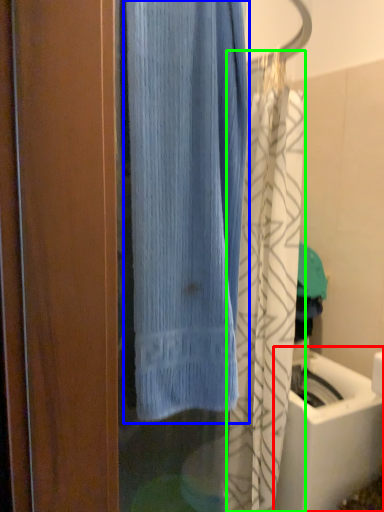
Question: Which is farther away from sink (highlighted by a red box)? curtain (highlighted by a blue box) or shower curtain (highlighted by a green box)?

Choices:
 (A) curtain
 (B) shower curtain

Answer: (A)